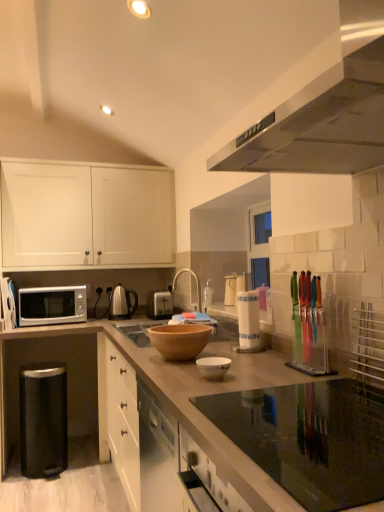
Image resolution: width=384 pixels, height=512 pixels. I want to click on free spot below black matte trash can at lower left (from a real-world perspective), so 61,465.